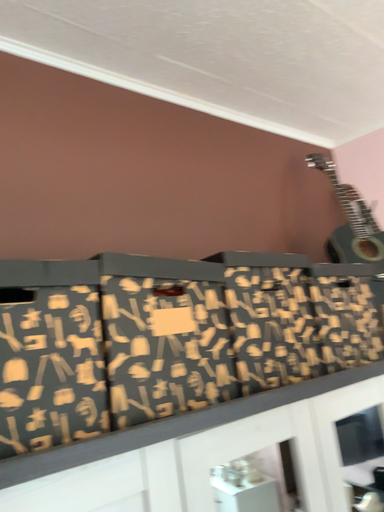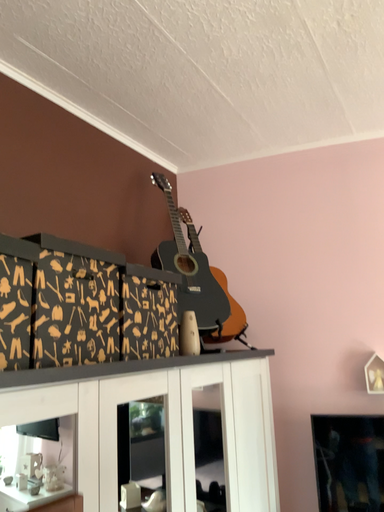
Question: How did the camera likely rotate when shooting the video?

Choices:
 (A) rotated left
 (B) rotated right

Answer: (B)